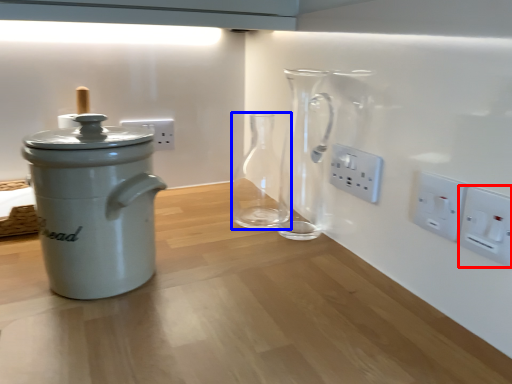
Question: Which object appears farthest to the camera in this image, electric outlet (highlighted by a red box) or glass vase (highlighted by a blue box)?

Choices:
 (A) electric outlet
 (B) glass vase

Answer: (B)